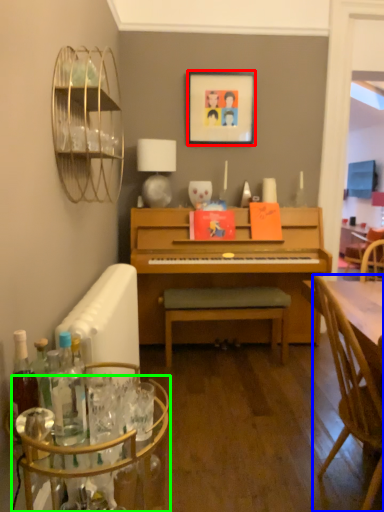
Question: Based on their relative distances, which object is nearer to picture frame (highlighted by a red box)? Choose from chair (highlighted by a blue box) and glass table (highlighted by a green box).

Choices:
 (A) chair
 (B) glass table

Answer: (A)